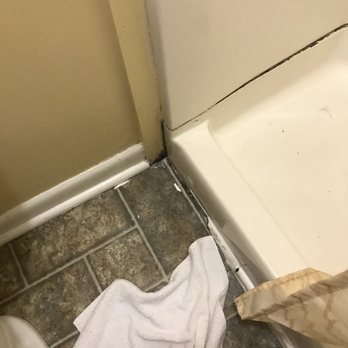
The image size is (348, 348). Identify the location of light brown molding. (131, 39).